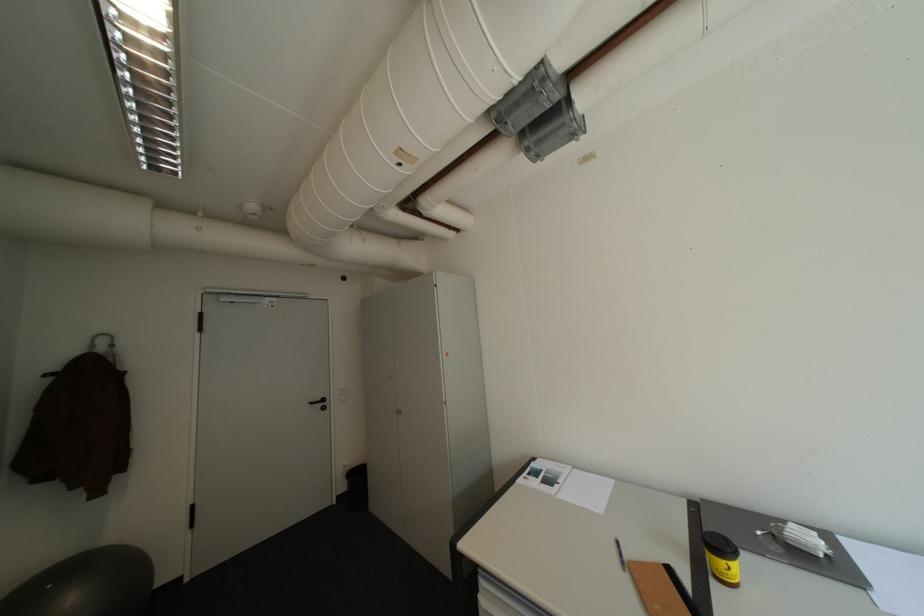
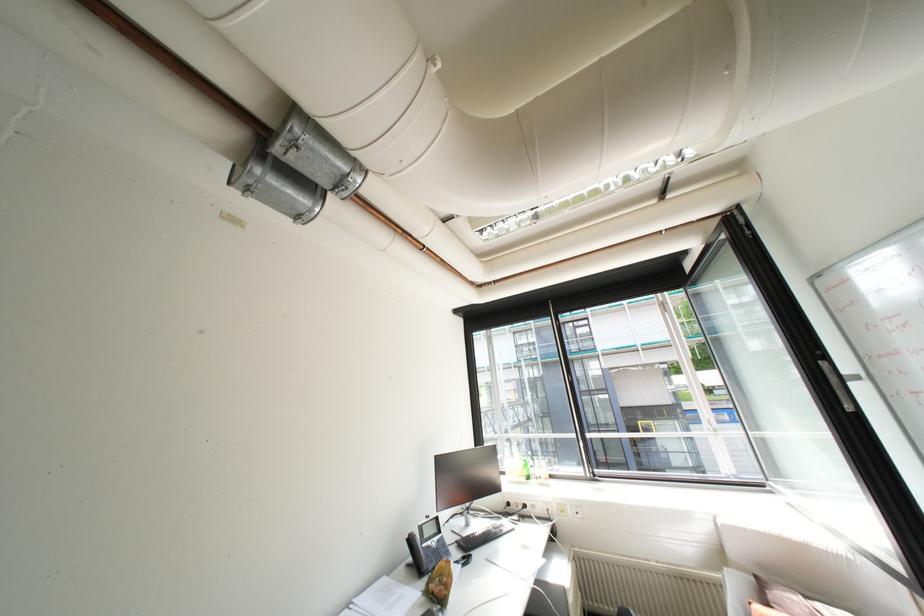
The first image is from the beginning of the video and the second image is from the end. How did the camera likely rotate when shooting the video?

The camera's rotation is toward right-up.